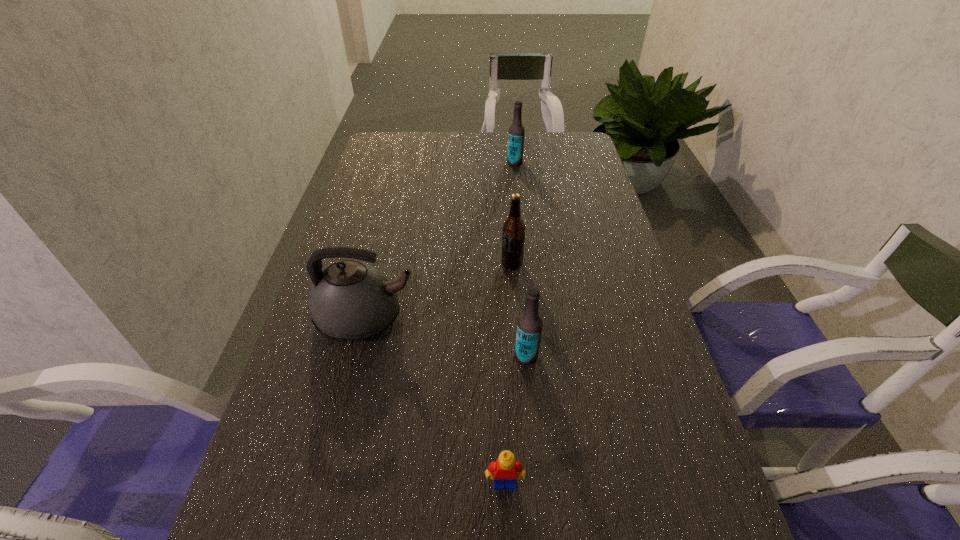
This screenshot has height=540, width=960. Find the location of `free space at the right edge of the desktop`. free space at the right edge of the desktop is located at coordinates (634, 354).

You are a GUI agent. You are given a task and a screenshot of the screen. Output one action in this format:
    pyautogui.click(x=<x>, y=<y>)
    Task: Click on the vacant area at the far right corner
    
    Given the screenshot: What is the action you would take?
    pyautogui.click(x=548, y=143)

Where is `unoccupied area between the nearest beer bottle and the leftmost object`? unoccupied area between the nearest beer bottle and the leftmost object is located at coordinates click(x=446, y=337).

What are the coordinates of `blank region between the nearest beer bottle and the second farthest object` in the screenshot? It's located at (519, 310).

The image size is (960, 540). Find the location of `vacant space that's between the second farthest object and the nearest object`. vacant space that's between the second farthest object and the nearest object is located at coordinates (508, 374).

Locate an element on the screen. vacant space that is in between the nearest beer bottle and the second farthest object is located at coordinates (519, 310).

The height and width of the screenshot is (540, 960). I want to click on free spot between the Lego and the leftmost object, so click(436, 401).

Locate an element on the screen. empty space that is in between the shortest object and the farthest object is located at coordinates (510, 323).

Where is `vacant point located between the kettle and the farthest object`? The height and width of the screenshot is (540, 960). vacant point located between the kettle and the farthest object is located at coordinates (441, 240).

Find the location of a particular element. free space between the kettle and the Lego is located at coordinates (436, 401).